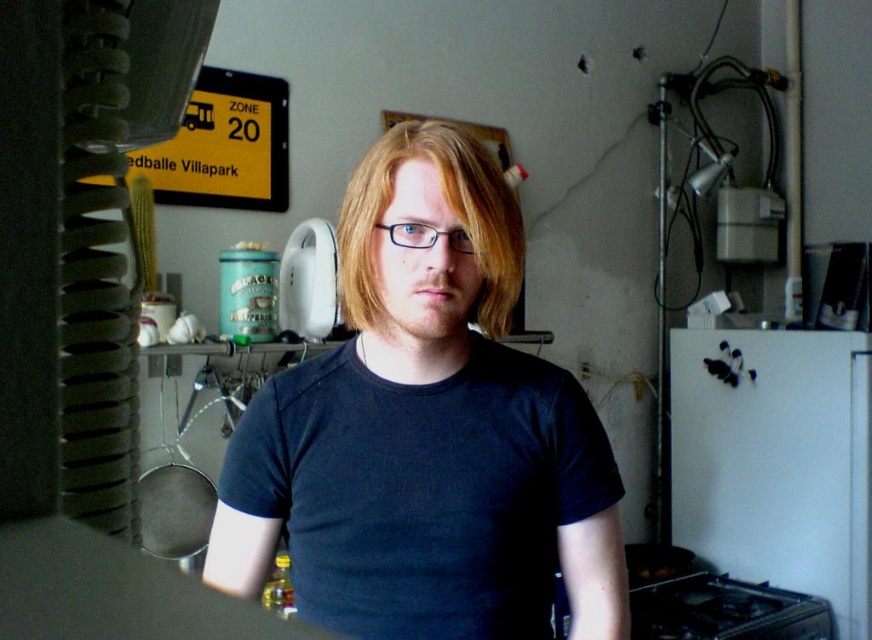
You are standing in a kitchen and see a point marked at coordinates (x=345, y=353). If you want to place a small plant pot there, which is 0.3 meters in diameter, will it fit without overlapping other objects?

The point at (x=345, y=353) is 1.16 meters away from you. Since the plant pot is only 0.3 meters in diameter, it should fit comfortably at that location without overlapping other objects.